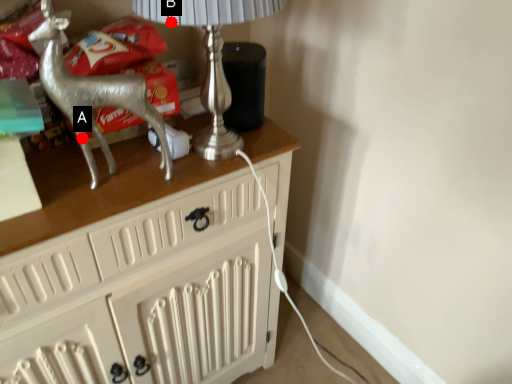
Question: Two points are circled on the image, labeled by A and B beside each circle. Which of the following is the closest to the observer?

Choices:
 (A) A is closer
 (B) B is closer

Answer: (B)